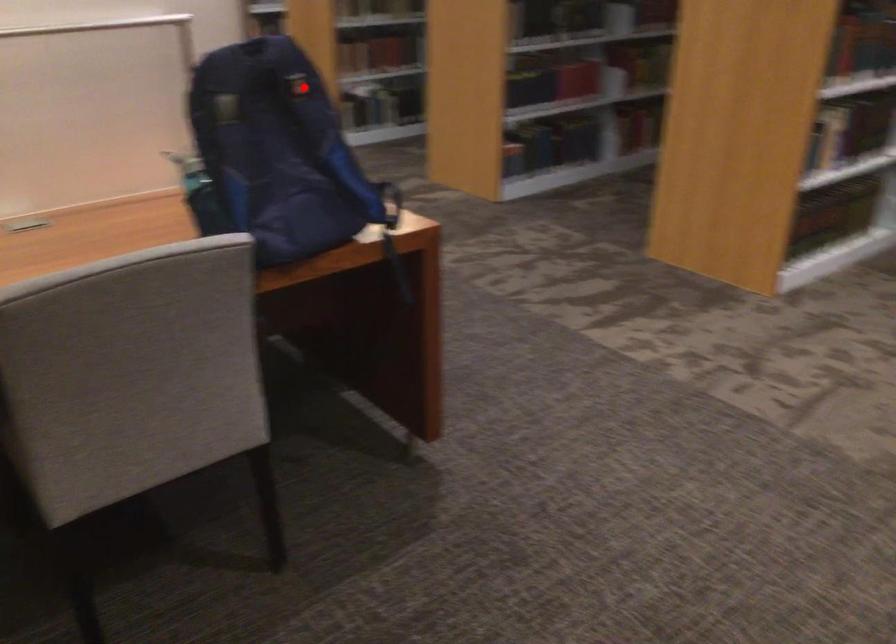
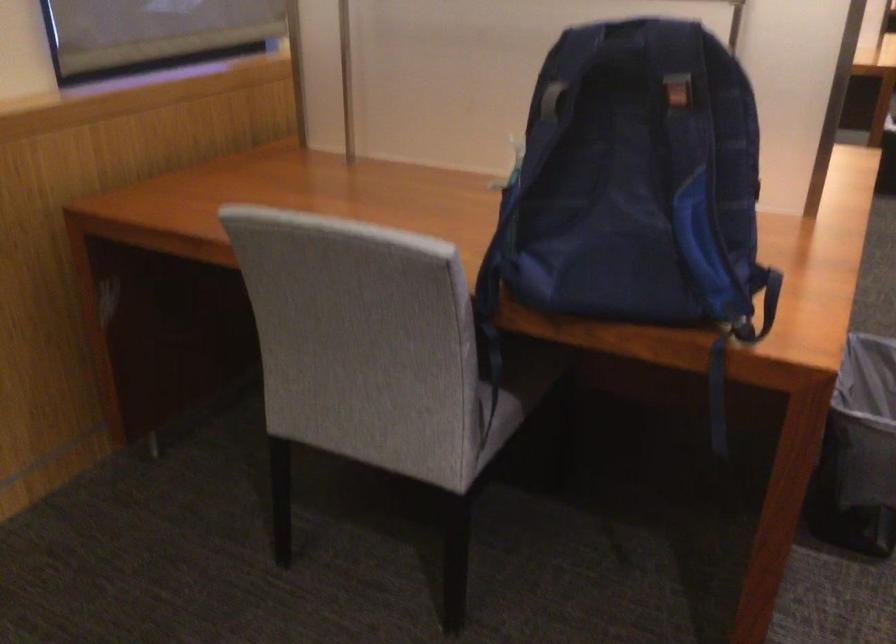
Locate, in the second image, the point that corresponds to the highlighted location in the first image.

(677, 93)